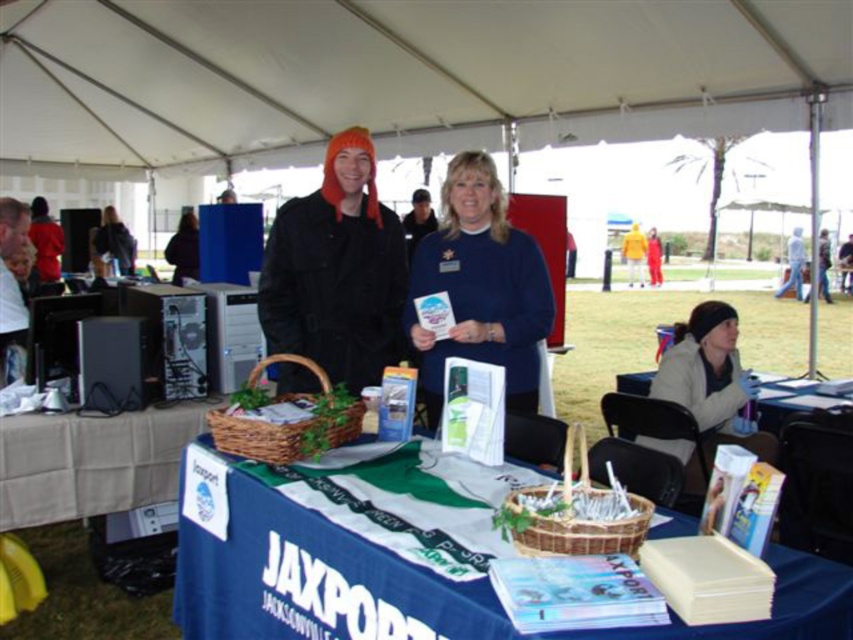
Question: Can you confirm if blue fabric table at center is wider than blue fleece sweater at center?

Choices:
 (A) no
 (B) yes

Answer: (B)

Question: Considering the real-world distances, which object is farthest from the yellow fabric jacket at center?

Choices:
 (A) beige fleece jacket at lower right
 (B) blue fabric table at center

Answer: (B)

Question: Considering the relative positions of blue fabric table at center and white cardboard box at center in the image provided, where is blue fabric table at center located with respect to white cardboard box at center?

Choices:
 (A) left
 (B) right

Answer: (B)

Question: Is blue fleece sweater at center smaller than white cardboard box at center?

Choices:
 (A) no
 (B) yes

Answer: (A)

Question: Which object appears closest to the camera in this image?

Choices:
 (A) beige fleece jacket at lower right
 (B) blue fleece sweater at center
 (C) blue fabric table at center
 (D) white cardboard box at center

Answer: (C)

Question: Which is nearer to the blue fabric table at center?

Choices:
 (A) beige fleece jacket at lower right
 (B) yellow fabric jacket at center

Answer: (A)